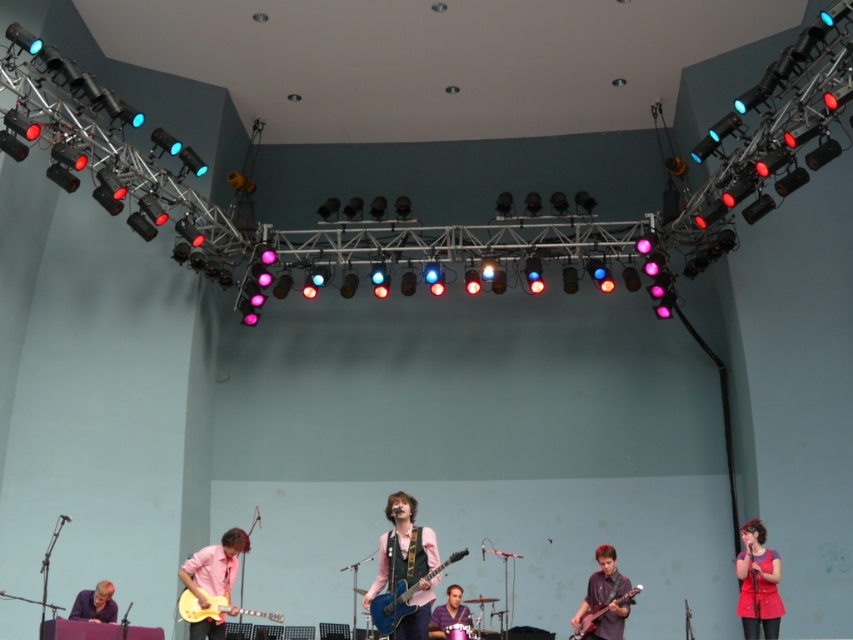
You are a photographer standing at the camera position. You want to capture a closeup shot of the pink matte guitar at lower left. Given that your camera can focus on objects within 5 meters, will you be able to capture a clear closeup shot?

The pink matte guitar at lower left is 6.54 meters from the camera, which is beyond the 5 meter focus range. Therefore, the photographer cannot capture a clear closeup shot.

You are a photographer positioned at the center of the stage. You want to take a photo of the pink matte shirt at center. Based on its 2D location, where should you aim your camera?

The pink matte shirt at center is located at the 2D coordinates point 0.881 on the x axis and 0.477 on the y axis. To capture it, aim your camera towards that specific point.

You are a stagehand who needs to adjust the lighting for the band members. You notice two points on the stage marked as point (451, 620) and point (590, 625). Which point is closer to the front of the stage?

Point (590, 625) is closer to the front of the stage because it is in front of point (451, 620).